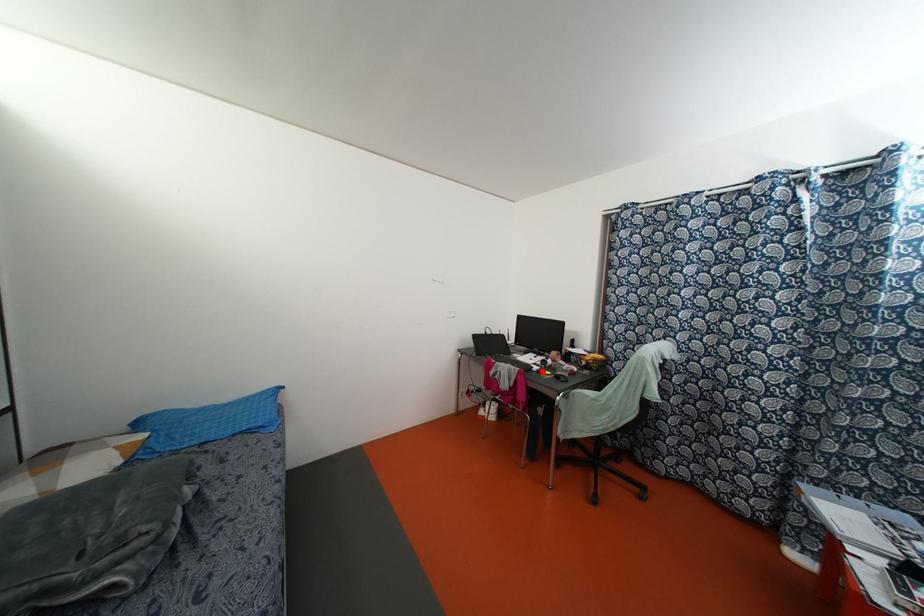
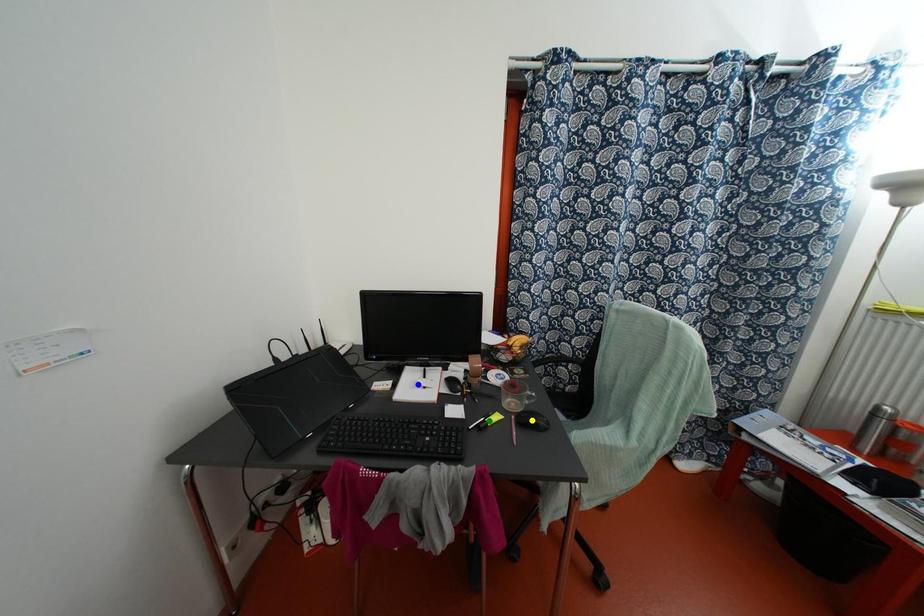
Question: I am providing you with two images of the same scene from different viewpoints. A red point is marked on the first image. You are given multiple points on the second image. In image 2, which mark is for the same physical point as the one in image 1?

Choices:
 (A) green point
 (B) yellow point
 (C) blue point

Answer: (A)